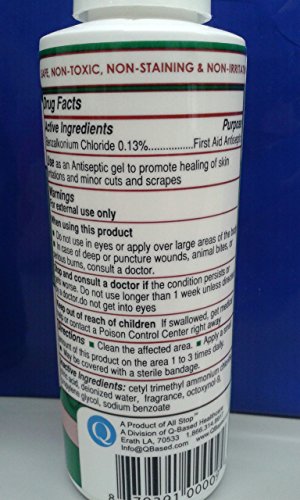
Where is `white table`? This screenshot has height=500, width=300. white table is located at coordinates (40, 428).